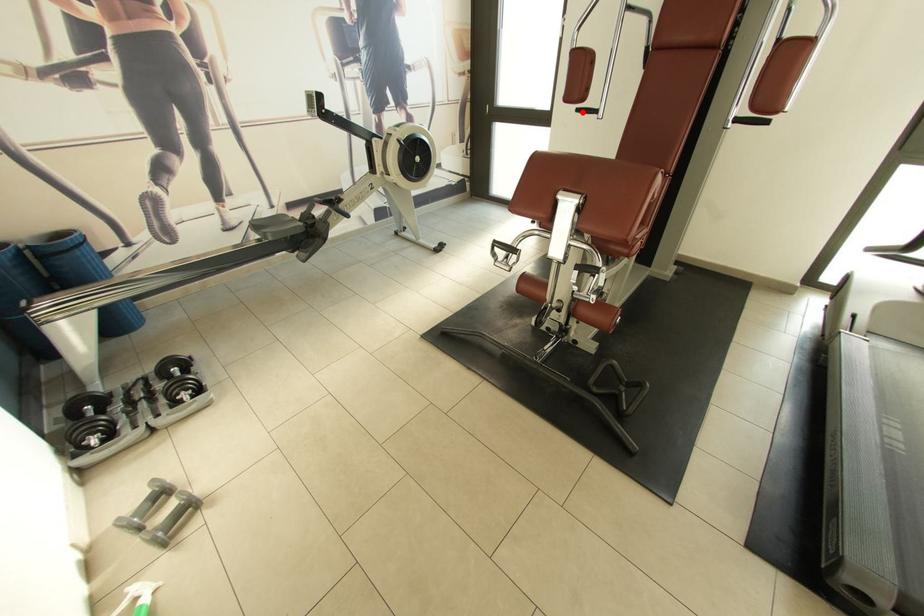
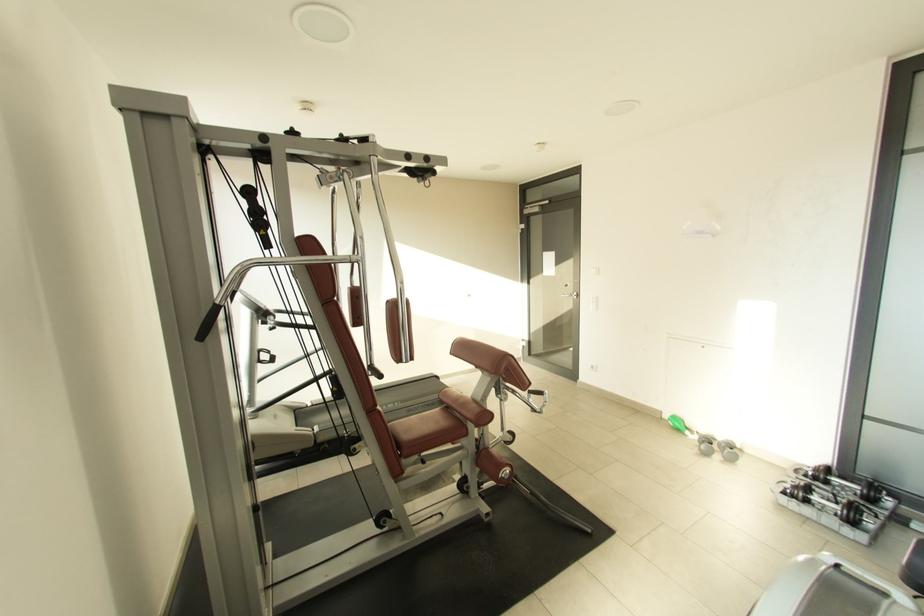
Question: I am providing you with two images of the same scene from different viewpoints. A red point is marked on the first image. At the location where the point appears in image 1, is it still visible in image 2?

Choices:
 (A) Yes
 (B) No

Answer: (B)